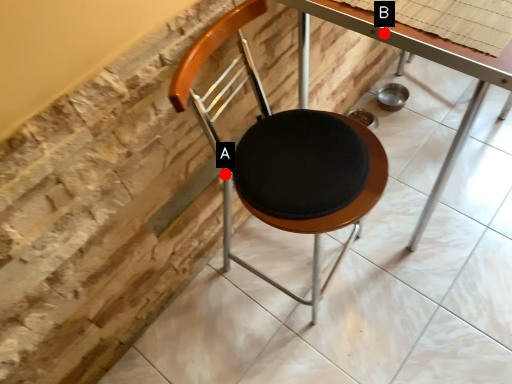
Question: Two points are circled on the image, labeled by A and B beside each circle. Which point is farther from the camera taking this photo?

Choices:
 (A) A is further
 (B) B is further

Answer: (A)